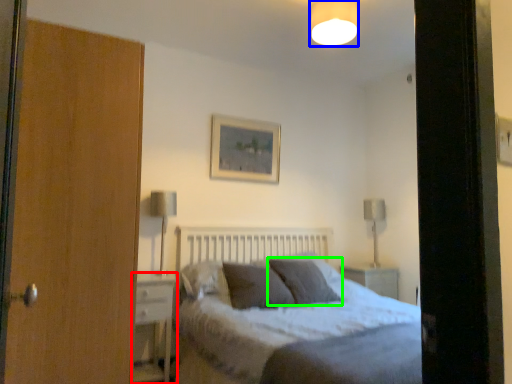
Question: Based on their relative distances, which object is nearer to nightstand (highlighted by a red box)? Choose from light fixture (highlighted by a blue box) and pillow (highlighted by a green box).

Choices:
 (A) light fixture
 (B) pillow

Answer: (B)